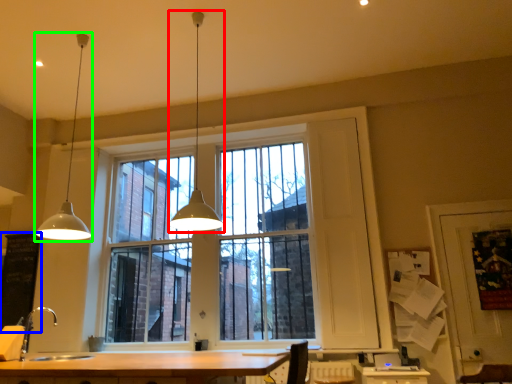
Question: Estimate the real-world distances between objects in this image. Which object is closer to lamp (highlighted by a red box), bulletin board (highlighted by a blue box) or lamp (highlighted by a green box)?

Choices:
 (A) bulletin board
 (B) lamp

Answer: (B)